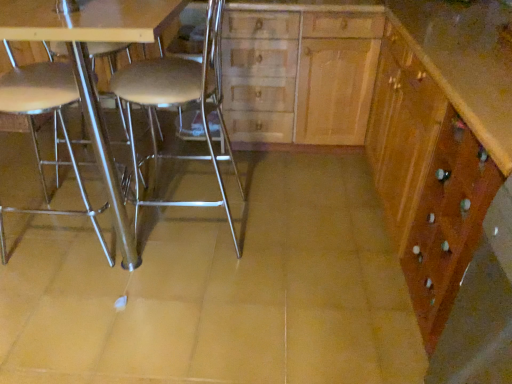
Where is `free spot to the right of metallic silver chair at left, placed as the first chair when sorted from left to right`? This screenshot has width=512, height=384. free spot to the right of metallic silver chair at left, placed as the first chair when sorted from left to right is located at coordinates (167, 245).